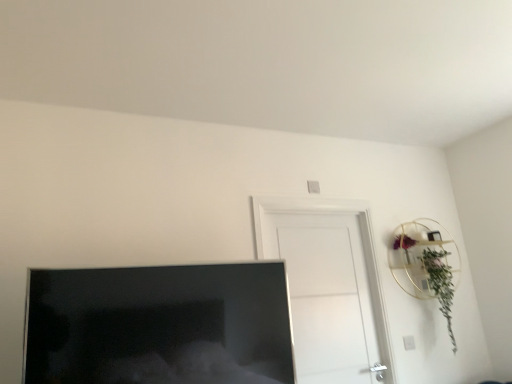
Question: Does matte black tv at lower left turn towards green leafy plant at upper right?

Choices:
 (A) yes
 (B) no

Answer: (B)

Question: From a real-world perspective, does matte black tv at lower left sit lower than green leafy plant at upper right?

Choices:
 (A) no
 (B) yes

Answer: (B)

Question: Is matte black tv at lower left further to camera compared to green leafy plant at upper right?

Choices:
 (A) no
 (B) yes

Answer: (A)

Question: Considering the relative sizes of matte black tv at lower left and green leafy plant at upper right in the image provided, is matte black tv at lower left shorter than green leafy plant at upper right?

Choices:
 (A) yes
 (B) no

Answer: (A)

Question: Can you confirm if matte black tv at lower left is taller than green leafy plant at upper right?

Choices:
 (A) yes
 (B) no

Answer: (B)

Question: Is matte black tv at lower left spatially inside green leafy plant at upper right, or outside of it?

Choices:
 (A) inside
 (B) outside

Answer: (B)

Question: Considering the positions of matte black tv at lower left and green leafy plant at upper right in the image, is matte black tv at lower left bigger or smaller than green leafy plant at upper right?

Choices:
 (A) big
 (B) small

Answer: (A)

Question: Looking at their shapes, would you say matte black tv at lower left is wider or thinner than green leafy plant at upper right?

Choices:
 (A) thin
 (B) wide

Answer: (A)

Question: Does point (118, 301) appear closer or farther from the camera than point (448, 299)?

Choices:
 (A) farther
 (B) closer

Answer: (B)

Question: Is point (288, 243) closer or farther from the camera than point (432, 253)?

Choices:
 (A) closer
 (B) farther

Answer: (A)

Question: In the image, is white matte door at center on the left side or the right side of green leafy plant at upper right?

Choices:
 (A) left
 (B) right

Answer: (A)

Question: From a real-world perspective, is white matte door at center positioned above or below green leafy plant at upper right?

Choices:
 (A) above
 (B) below

Answer: (A)

Question: Considering the positions of white matte door at center and green leafy plant at upper right in the image, is white matte door at center taller or shorter than green leafy plant at upper right?

Choices:
 (A) short
 (B) tall

Answer: (B)

Question: In terms of size, does green leafy plant at upper right appear bigger or smaller than white matte door at center?

Choices:
 (A) big
 (B) small

Answer: (B)

Question: Is green leafy plant at upper right to the left or to the right of white matte door at center in the image?

Choices:
 (A) left
 (B) right

Answer: (B)